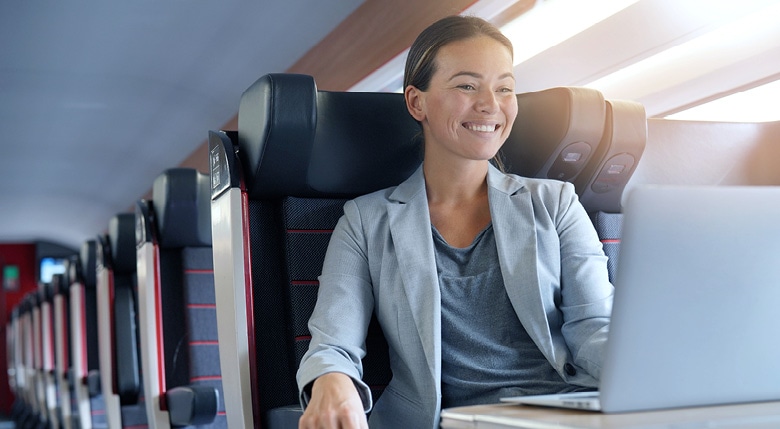
This screenshot has width=780, height=429. I want to click on seat, so click(x=252, y=308), click(x=197, y=295), click(x=129, y=314), click(x=82, y=317), click(x=43, y=322), click(x=62, y=324), click(x=18, y=327), click(x=25, y=328).